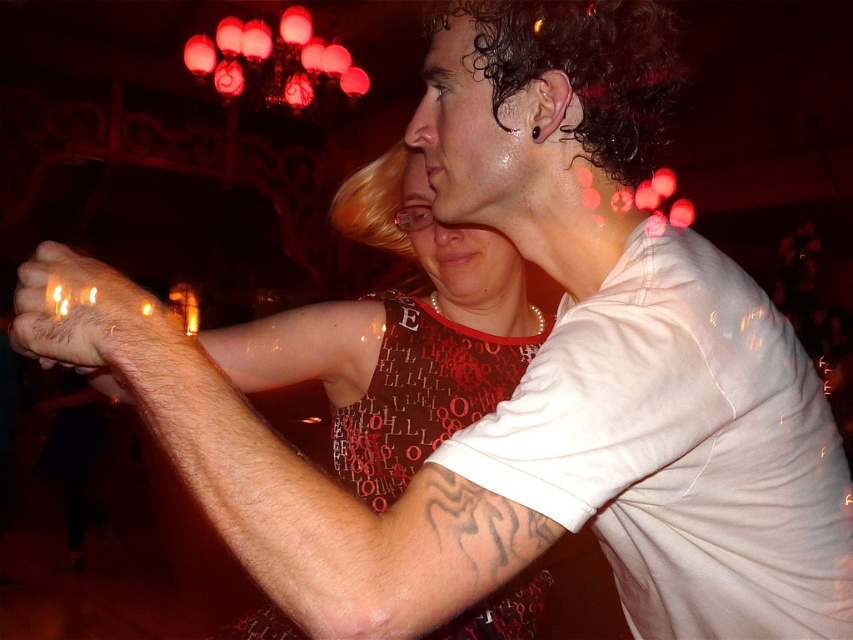
Does hair at center have a greater width compared to hairy skin at center?

Yes, hair at center is wider than hairy skin at center.

Describe the element at coordinates (183, 337) in the screenshot. I see `hair at center` at that location.

Is point (314, 365) positioned in front of point (90, 273)?

No, it is behind (90, 273).

Find the location of a particular element. hair at center is located at coordinates (183, 337).